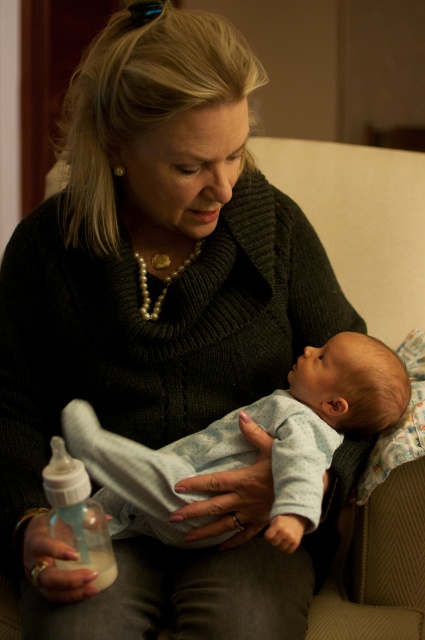
Who is higher up, light blue soft fabric baby at center or translucent plastic bottle at lower left?

light blue soft fabric baby at center

Who is more distant from viewer, (x=365, y=339) or (x=71, y=474)?

The point (x=365, y=339) is more distant.

The width and height of the screenshot is (425, 640). Find the location of `light blue soft fabric baby at center`. light blue soft fabric baby at center is located at coordinates (325, 420).